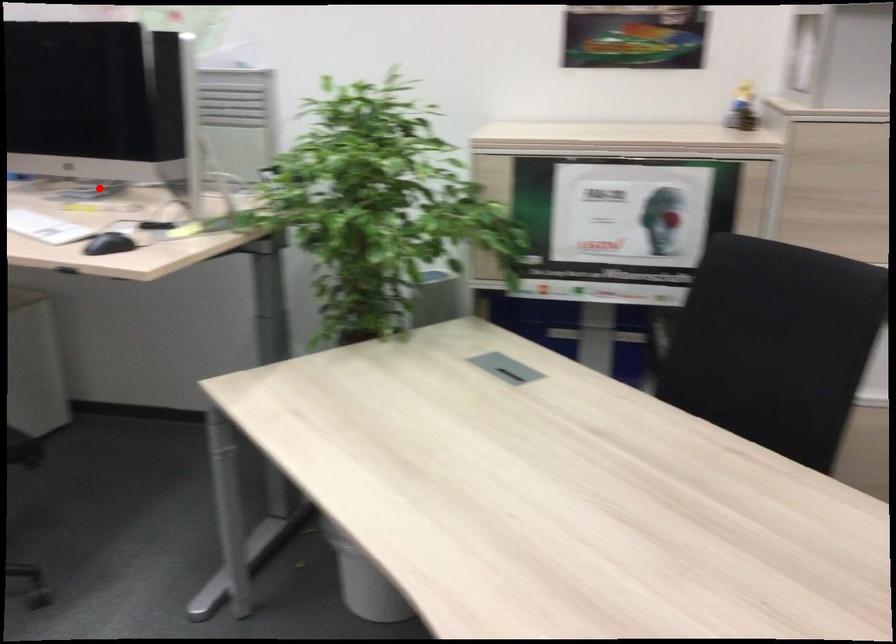
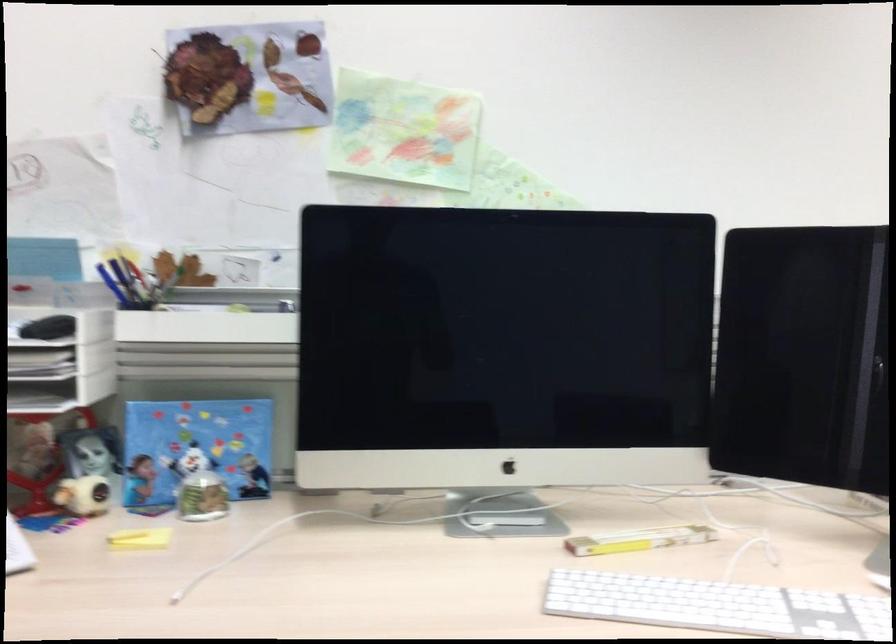
In the second image, find the point that corresponds to the highlighted location in the first image.

(449, 494)